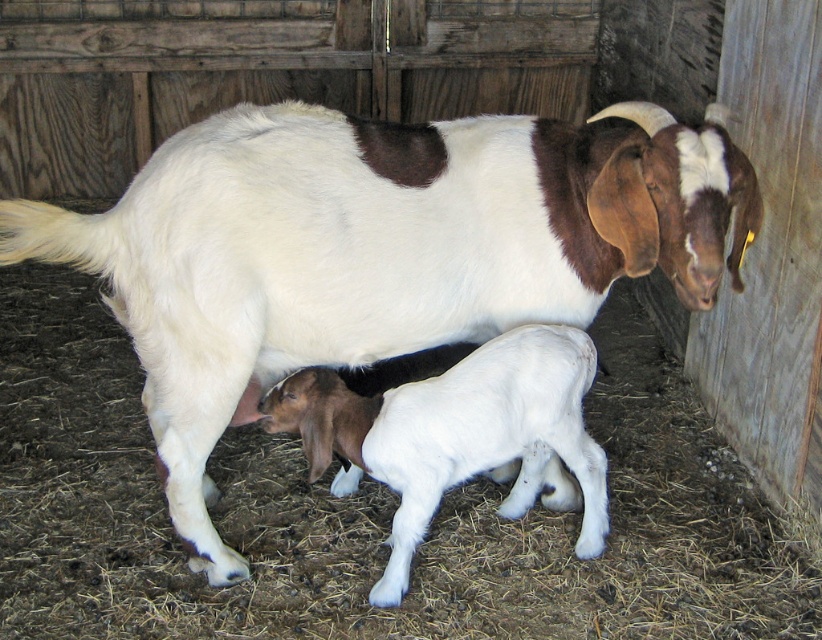
You are a farmer checking the barn. You see the white soft fur goat at center and the white woolen lamb at center. Which animal is positioned more to the left side of the barn?

The white soft fur goat at center is positioned more to the left side of the barn than the white woolen lamb at center.

Where is the white soft fur goat at center located in the image?

The white soft fur goat at center is located at point [377,250] in the image.

You are a farmer checking the health of the animals in the barn. You notice two animals at the center of the scene. Which animal has a greater body width between the white soft fur goat at center and the white woolen lamb at center?

The white soft fur goat at center has a greater body width than the white woolen lamb at center according to the description.